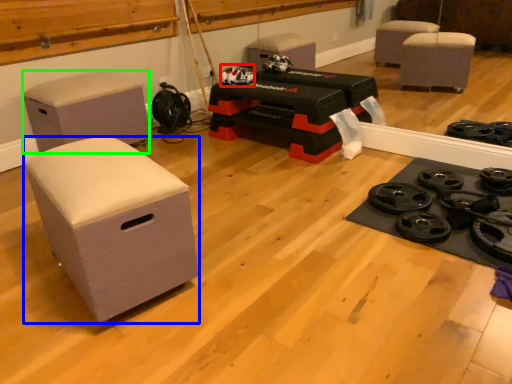
Question: Based on their relative distances, which object is nearer to toy (highlighted by a red box)? Choose from chest of drawers (highlighted by a blue box) and furniture (highlighted by a green box).

Choices:
 (A) chest of drawers
 (B) furniture

Answer: (B)